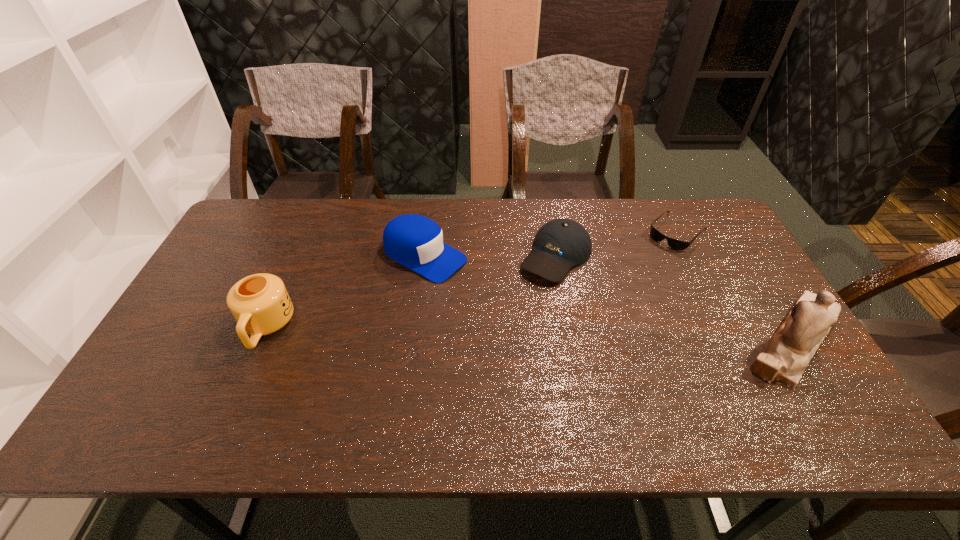
Image resolution: width=960 pixels, height=540 pixels. I want to click on free space on the desktop that is between the leftmost object and the figurine and is positioned on the front-facing side of the shortest object, so click(575, 335).

Identify the location of vacant space on the desktop that is between the mug and the figurine and is positioned on the front-facing side of the fourth tallest object. The height and width of the screenshot is (540, 960). (495, 333).

Identify the location of free space on the desktop that is between the leftmost object and the figurine and is positioned on the front-facing side of the fourth object from right to left. (572, 335).